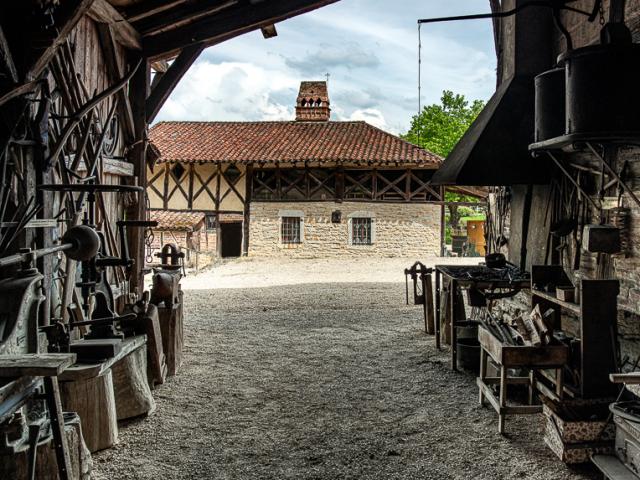
The image size is (640, 480). I want to click on wooden work table, so click(41, 360).